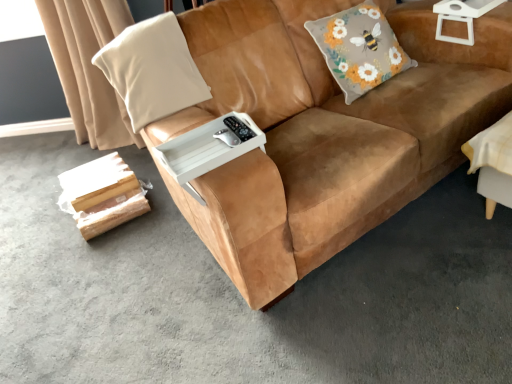
Question: From the image's perspective, relative to white plastic side table at upper right, is beige fabric pillow at left, arranged as the first throw pillow when viewed from the left, above or below?

Choices:
 (A) below
 (B) above

Answer: (A)

Question: Is beige fabric pillow at left, the second throw pillow when ordered from right to left, to the left or to the right of white plastic side table at upper right in the image?

Choices:
 (A) left
 (B) right

Answer: (A)

Question: Which of these objects is positioned farthest from the beige fabric curtain at upper left?

Choices:
 (A) fluffy gray cushion with floral design at upper right, which ranks as the 2th throw pillow in left-to-right order
 (B) white plastic tray at center
 (C) suede brown couch at center
 (D) beige fabric pillow at left, the second throw pillow when ordered from right to left
 (E) white plastic side table at upper right

Answer: (E)

Question: Which object is positioned closest to the beige fabric pillow at left, the second throw pillow when ordered from right to left?

Choices:
 (A) white plastic side table at upper right
 (B) suede brown couch at center
 (C) beige fabric curtain at upper left
 (D) white plastic tray at center
 (E) fluffy gray cushion with floral design at upper right, which ranks as the 2th throw pillow in left-to-right order

Answer: (B)